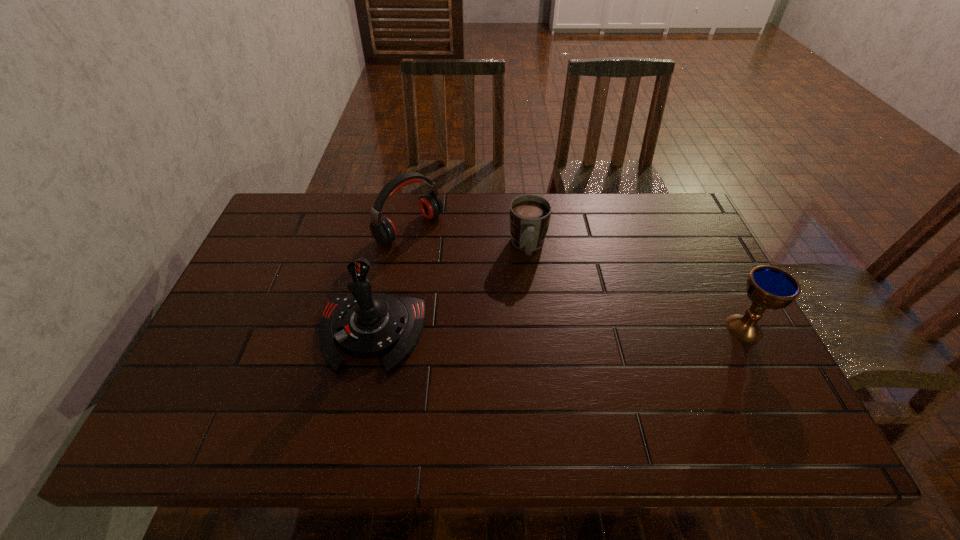
Locate an element on the screen. The width and height of the screenshot is (960, 540). joystick is located at coordinates (368, 325).

Identify the location of the rightmost object. The width and height of the screenshot is (960, 540). (768, 287).

The height and width of the screenshot is (540, 960). What are the coordinates of `earphone` in the screenshot? It's located at (383, 230).

Where is `the shortest object`? the shortest object is located at coordinates (530, 215).

At what (x,y) coordinates should I click in order to perform the action: click on mug. Please return your answer as a coordinate pair (x, y). Image resolution: width=960 pixels, height=540 pixels. Looking at the image, I should click on (530, 215).

This screenshot has height=540, width=960. Identify the location of free region located on the left of the rightmost object. (581, 328).

You are a GUI agent. You are given a task and a screenshot of the screen. Output one action in this format:
    pyautogui.click(x=<x>, y=<y>)
    Task: Click on the blank space located on the ear cups of the earphone
    
    Given the screenshot: What is the action you would take?
    pyautogui.click(x=448, y=258)

The image size is (960, 540). I want to click on free space located 0.170m on the ear cups of the earphone, so click(470, 274).

I want to click on blank area located on the ear cups of the earphone, so click(x=533, y=321).

Find the location of a particular element. vacant region located 0.360m on the side of the third object from left to right with the handle is located at coordinates (530, 377).